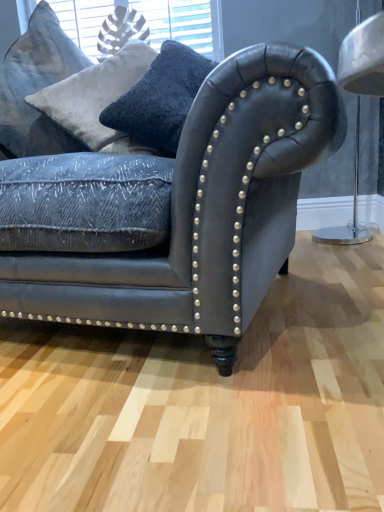
Question: Considering the positions of matte black leather couch at center and velvety gray pillow at upper left in the image, is matte black leather couch at center bigger or smaller than velvety gray pillow at upper left?

Choices:
 (A) small
 (B) big

Answer: (B)

Question: From the image's perspective, relative to velvety gray pillow at upper left, is matte black leather couch at center above or below?

Choices:
 (A) above
 (B) below

Answer: (B)

Question: Would you say matte black leather couch at center is to the left or to the right of velvety gray pillow at upper left in the picture?

Choices:
 (A) left
 (B) right

Answer: (B)

Question: Is velvety gray pillow at upper left to the left or to the right of matte black leather couch at center in the image?

Choices:
 (A) left
 (B) right

Answer: (A)

Question: Is velvety gray pillow at upper left inside the boundaries of matte black leather couch at center, or outside?

Choices:
 (A) inside
 (B) outside

Answer: (A)

Question: Looking at their shapes, would you say velvety gray pillow at upper left is wider or thinner than matte black leather couch at center?

Choices:
 (A) thin
 (B) wide

Answer: (A)

Question: Is velvety gray pillow at upper left in front of or behind matte black leather couch at center in the image?

Choices:
 (A) behind
 (B) front

Answer: (A)